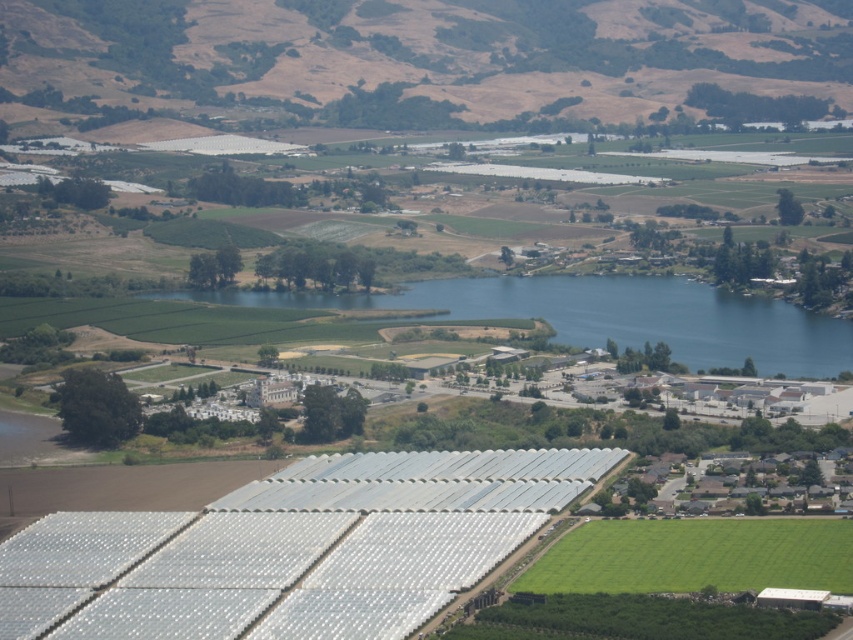
Question: Does brown/dry grass at upper center appear on the left side of blue water at center?

Choices:
 (A) yes
 (B) no

Answer: (A)

Question: Is brown/dry grass at upper center further to camera compared to blue water at center?

Choices:
 (A) no
 (B) yes

Answer: (B)

Question: Which point is farther to the camera?

Choices:
 (A) blue water at center
 (B) brown/dry grass at upper center

Answer: (B)

Question: Does brown/dry grass at upper center appear on the left side of blue water at center?

Choices:
 (A) no
 (B) yes

Answer: (B)